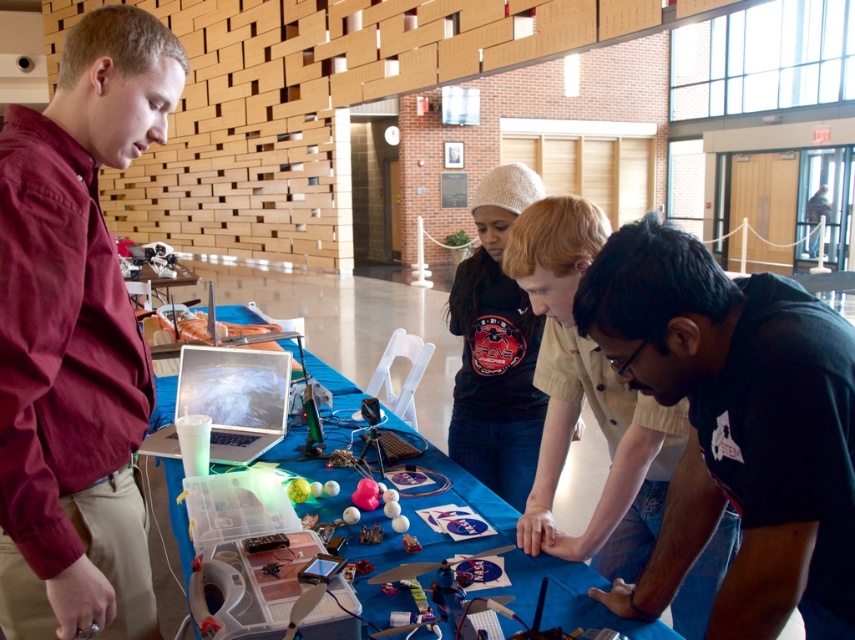
You are standing in the room and see the matte black shirt at center. Can you estimate its position relative to the center of the room?

The matte black shirt at center is located at point 0.627 along the x axis and 0.688 along the y axis relative to the center of the room.

You are a delivery person carrying a package that is 3 feet wide. You need to walk through the space between the maroon shirt at left and the dark blue sweater at center. Can your package fit through the gap?

The distance between the maroon shirt at left and the dark blue sweater at center is 3.34 feet, so the 3 feet wide package can fit through the gap since it is narrower than the available space.

In the scene, there are four people around a table. The maroon shirt at left is represented by point (75, 339). Where is the person in the black shirt with a circular logo?

The person in the black shirt with a circular logo is next to the maroon shirt at left, as described in the scene.